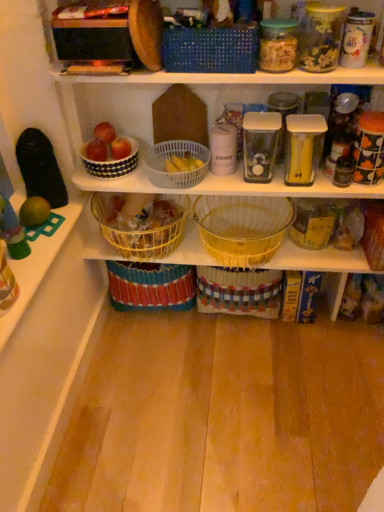
Question: Considering the relative sizes of white glossy canister at upper right, which appears as the 5th glass jar when viewed from the left, and black glass jar at right in the image provided, is white glossy canister at upper right, which appears as the 5th glass jar when viewed from the left, taller than black glass jar at right?

Choices:
 (A) no
 (B) yes

Answer: (B)

Question: Does white glossy canister at upper right, which appears as the 5th glass jar when viewed from the left, come in front of black glass jar at right?

Choices:
 (A) yes
 (B) no

Answer: (A)

Question: Is white glossy canister at upper right, arranged as the 1th glass jar when viewed from the right, outside of black glass jar at right?

Choices:
 (A) no
 (B) yes

Answer: (B)

Question: From a real-world perspective, is white glossy canister at upper right, arranged as the 1th glass jar when viewed from the right, on black glass jar at right?

Choices:
 (A) yes
 (B) no

Answer: (A)

Question: From the image's perspective, is white glossy canister at upper right, arranged as the 1th glass jar when viewed from the right, over black glass jar at right?

Choices:
 (A) yes
 (B) no

Answer: (A)

Question: Considering the positions of red matte apple at upper left, positioned as the 1th apple in left-to-right order, and blue woven basket at upper center, marked as the 3th basket in a left-to-right arrangement, in the image, is red matte apple at upper left, positioned as the 1th apple in left-to-right order, bigger or smaller than blue woven basket at upper center, marked as the 3th basket in a left-to-right arrangement,?

Choices:
 (A) small
 (B) big

Answer: (A)

Question: Is red matte apple at upper left, marked as the 2th apple in a right-to-left arrangement, inside the boundaries of blue woven basket at upper center, the third basket in the right-to-left sequence, or outside?

Choices:
 (A) outside
 (B) inside

Answer: (A)

Question: Looking at their shapes, would you say red matte apple at upper left, positioned as the 1th apple in left-to-right order, is wider or thinner than blue woven basket at upper center, marked as the 3th basket in a left-to-right arrangement?

Choices:
 (A) wide
 (B) thin

Answer: (B)

Question: Is point (89, 145) closer or farther from the camera than point (203, 31)?

Choices:
 (A) closer
 (B) farther

Answer: (B)

Question: Is black glass jar at right bigger or smaller than red matte apple at upper left, marked as the 2th apple in a right-to-left arrangement?

Choices:
 (A) small
 (B) big

Answer: (B)

Question: From the image's perspective, is black glass jar at right above or below red matte apple at upper left, positioned as the 1th apple in left-to-right order?

Choices:
 (A) below
 (B) above

Answer: (A)

Question: Considering the positions of black glass jar at right and red matte apple at upper left, positioned as the 1th apple in left-to-right order, in the image, is black glass jar at right taller or shorter than red matte apple at upper left, positioned as the 1th apple in left-to-right order,?

Choices:
 (A) tall
 (B) short

Answer: (A)

Question: Is black glass jar at right in front of or behind red matte apple at upper left, positioned as the 1th apple in left-to-right order, in the image?

Choices:
 (A) front
 (B) behind

Answer: (A)

Question: Visually, is shiny red apple at upper center, marked as the 1th apple in a right-to-left arrangement, positioned to the left or to the right of clear plastic container at center, the third glass jar positioned from the left?

Choices:
 (A) left
 (B) right

Answer: (A)

Question: From a real-world perspective, is shiny red apple at upper center, positioned as the second apple in left-to-right order, above or below clear plastic container at center, the third glass jar positioned from the left?

Choices:
 (A) above
 (B) below

Answer: (B)